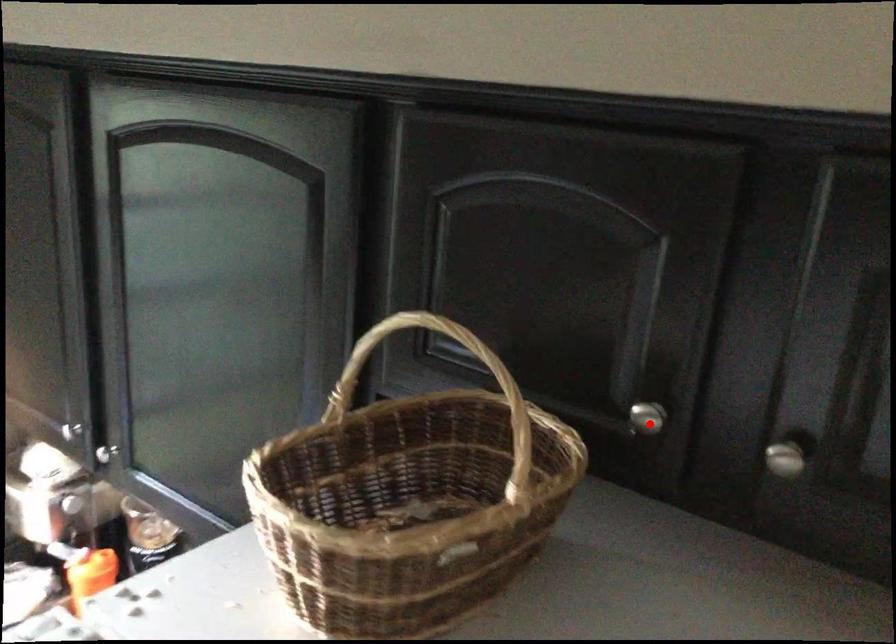
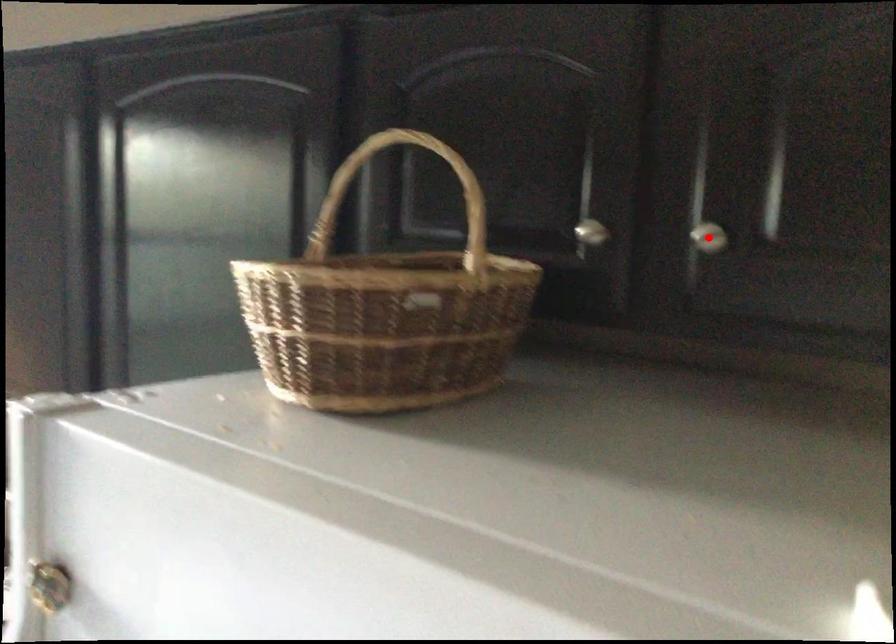
I am providing you with two images of the same scene from different viewpoints. A red point is marked on the first image and another point is marked on the second image. Are the points marked in image1 and image2 representing the same 3D position?

No